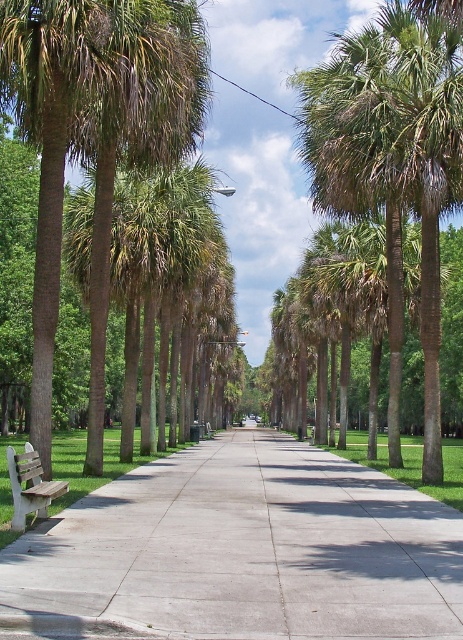
You are planning to place a small potted plant between the white concrete pavement at lower left and the wooden bench at lower left. Based on the scene description, which object should the plant be closer to if you want it to be near the wider area?

The white concrete pavement at lower left is wider than the wooden bench at lower left, so the plant should be placed closer to the white concrete pavement at lower left to be near the wider area.

You are standing at the entrance of the pathway and see two points marked on the path. The first point is at coordinate point (298, 625) and the second point is at coordinate point (371, 144). Which point is closer to you?

Point (298, 625) is closer to the viewer than point (371, 144).